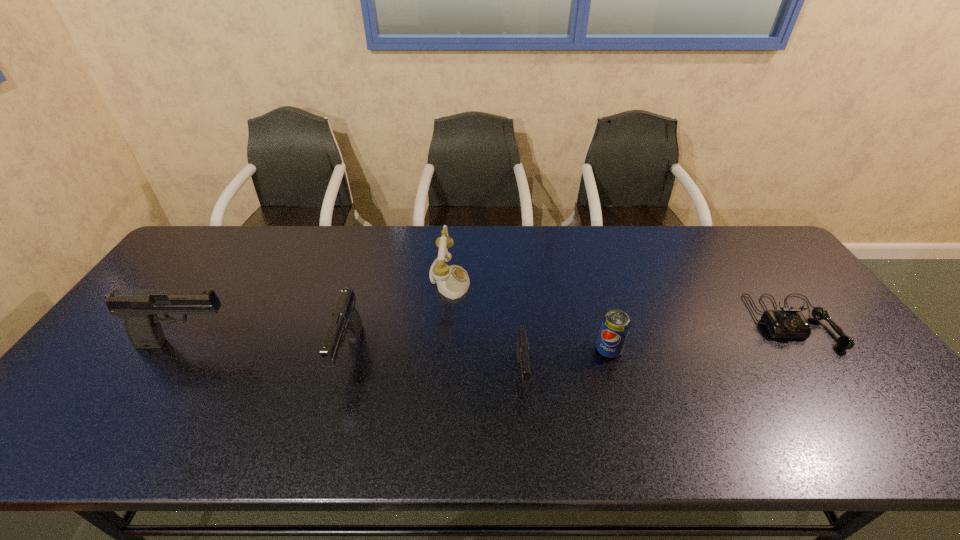
The image size is (960, 540). Find the location of `free space that satisfies the following two spatial constraints: 1. aim along the barrel of the soda; 2. on the left side of the leftmost object`. free space that satisfies the following two spatial constraints: 1. aim along the barrel of the soda; 2. on the left side of the leftmost object is located at coordinates (183, 350).

The image size is (960, 540). In order to click on free point that satisfies the following two spatial constraints: 1. on the dial of the right telephone; 2. aim along the barrel of the leftmost object in this screenshot , I will do `click(807, 343)`.